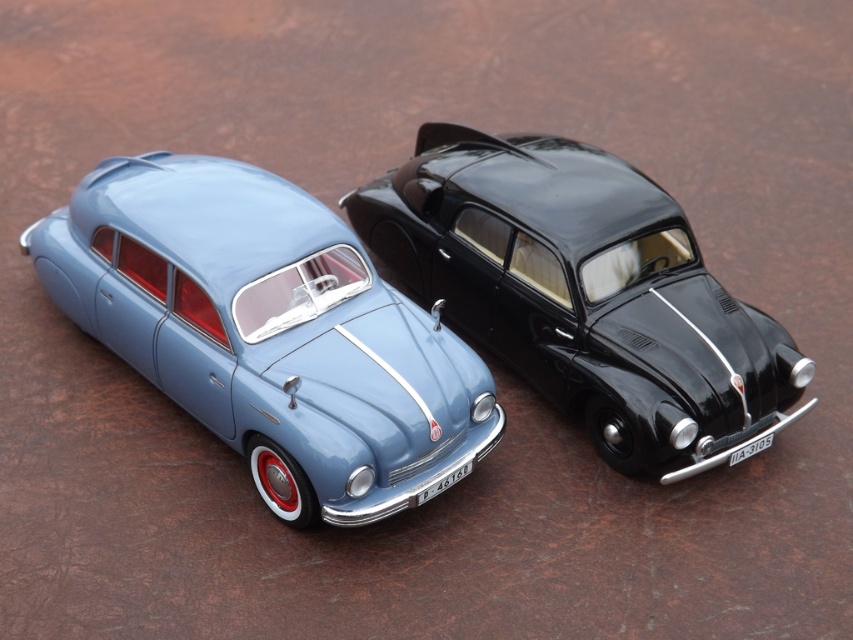
Is matte blue car at center shorter than shiny black car at center?

Yes.

Between point (138, 291) and point (459, 144), which one is positioned behind?

Point (459, 144)

Image resolution: width=853 pixels, height=640 pixels. I want to click on matte blue car at center, so click(270, 332).